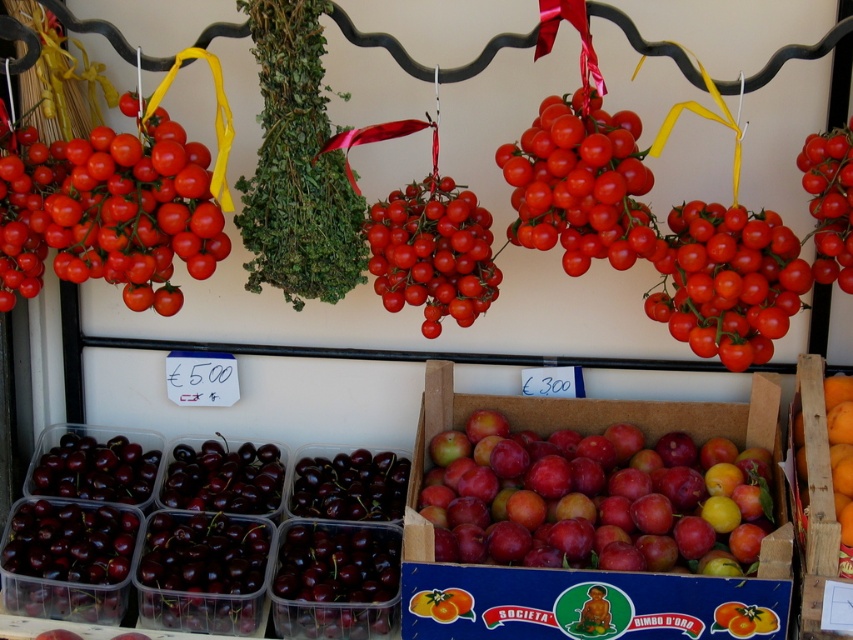
Question: Which object appears closest to the camera in this image?

Choices:
 (A) orange matte wood crate at lower right
 (B) shiny dark red cherries at lower left

Answer: (A)

Question: Which object is positioned farthest from the glossy red cherry at center?

Choices:
 (A) glossy cherry tomatoes at upper right
 (B) glossy red tomato at left
 (C) orange matte wood crate at lower right

Answer: (C)

Question: From the image, what is the correct spatial relationship of glossy red cherry at center in relation to dark purple glossy cherries at center?

Choices:
 (A) below
 (B) above

Answer: (B)

Question: Which object is positioned farthest from the glossy red cherry at center?

Choices:
 (A) dark purple glossy cherries at center
 (B) glossy red tomato at left
 (C) glossy cherry tomatoes at upper right

Answer: (C)

Question: In this image, where is glossy red cherry at center located relative to shiny dark red cherries at lower left?

Choices:
 (A) above
 (B) below

Answer: (A)

Question: Is shiny dark red cherries at lower left in front of dark purple glossy cherries at center?

Choices:
 (A) yes
 (B) no

Answer: (B)